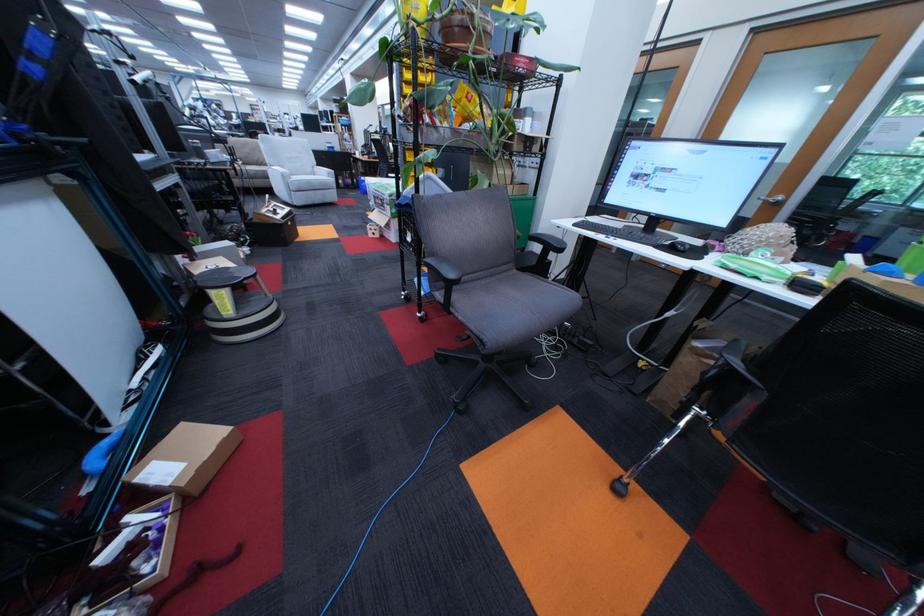
Where is `round step stool`? This screenshot has height=616, width=924. round step stool is located at coordinates (237, 305).